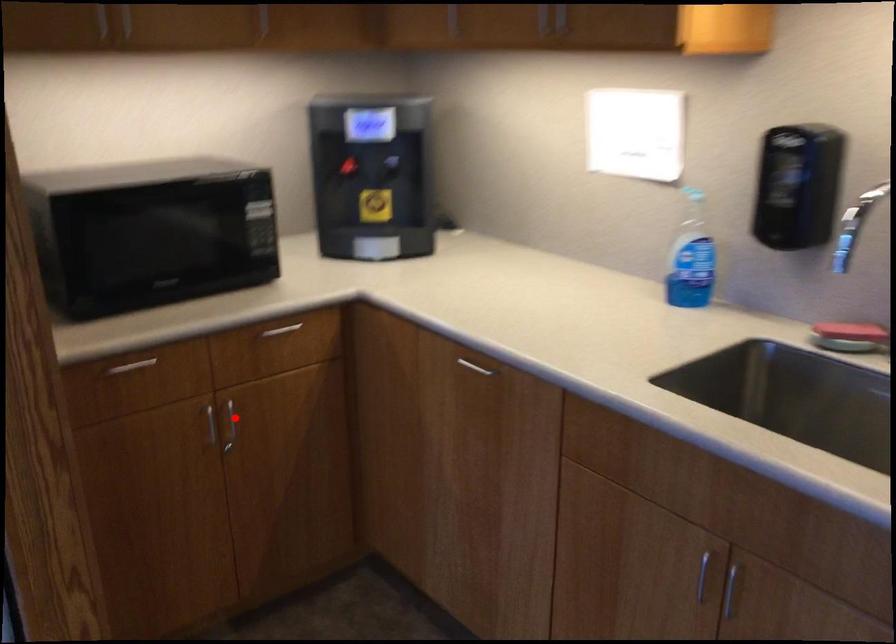
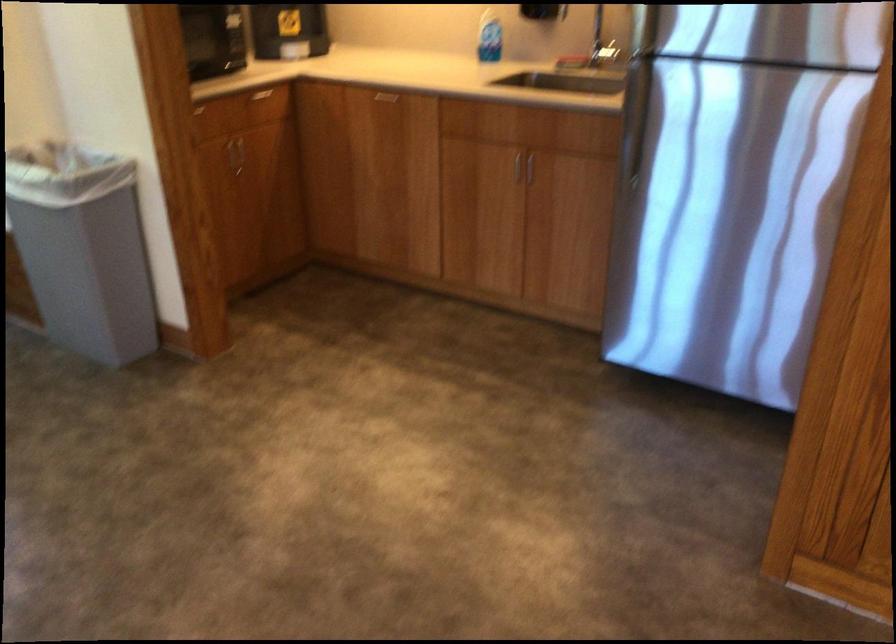
Question: I am providing you with two images of the same scene from different viewpoints. Given a red point in image1, look at the same physical point in image2. Is it:

Choices:
 (A) Closer to the viewpoint
 (B) Farther from the viewpoint

Answer: (B)